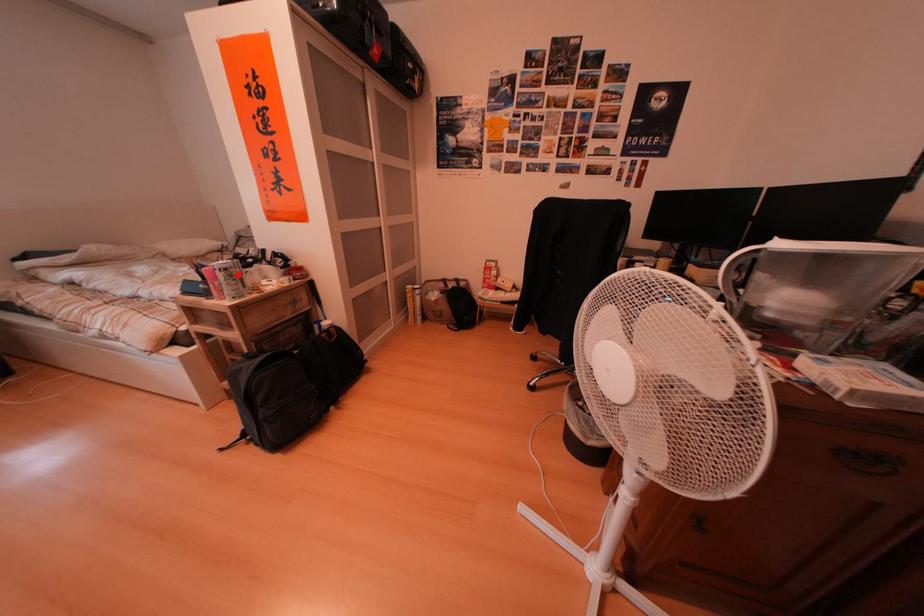
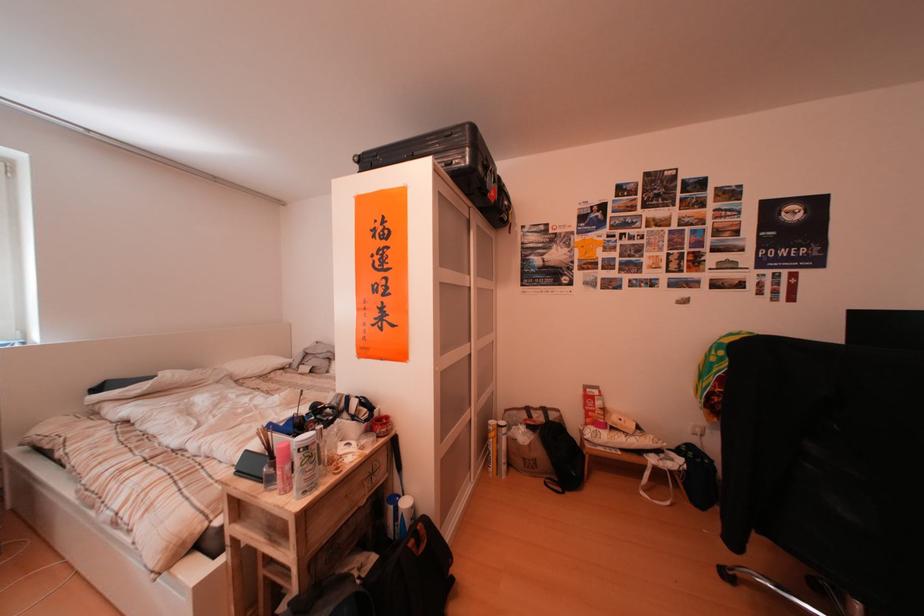
Where in the second image is the point corresponding to the highlighted location from the first image?

(320, 453)